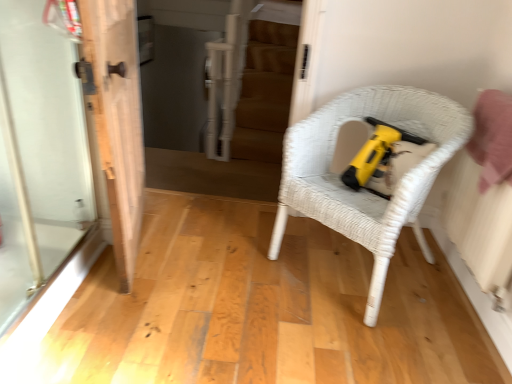
The height and width of the screenshot is (384, 512). I want to click on white wicker chair at center, so click(366, 191).

Describe the element at coordinates (366, 191) in the screenshot. I see `white wicker chair at center` at that location.

In order to click on white wood door at left in this screenshot , I will do `click(117, 119)`.

Considering the sizes of objects white wood door at left and white wicker chair at center in the image provided, who is thinner, white wood door at left or white wicker chair at center?

Thinner between the two is white wood door at left.

Can we say white wood door at left lies outside white wicker chair at center?

white wood door at left lies outside white wicker chair at center's area.

From a real-world perspective, is white wood door at left under white wicker chair at center?

No, from a real-world perspective, white wood door at left is not under white wicker chair at center.

From the image's perspective, which one is positioned higher, white wood door at left or white wicker chair at center?

From the image's view, white wood door at left is above.

Which is in front, transparent glass screen door at left or white wicker chair at center?

transparent glass screen door at left is closer to the camera.

Could you tell me if transparent glass screen door at left is turned towards white wicker chair at center?

Yes, transparent glass screen door at left is aimed at white wicker chair at center.

Who is bigger, transparent glass screen door at left or white wicker chair at center?

white wicker chair at center.

Is white wood door at left completely or partially inside white wicker chair at center?

No, white wood door at left is located outside of white wicker chair at center.

In the image, is white wicker chair at center on the left side or the right side of white wood door at left?

white wicker chair at center is to the right of white wood door at left.

Is white wicker chair at center aimed at white wood door at left?

No, white wicker chair at center is not facing towards white wood door at left.

Which is more to the left, white wood door at left or transparent glass screen door at left?

Positioned to the left is transparent glass screen door at left.

Does white wood door at left have a smaller size compared to transparent glass screen door at left?

Incorrect, white wood door at left is not smaller in size than transparent glass screen door at left.

Is white wood door at left facing towards transparent glass screen door at left?

No, white wood door at left is not aimed at transparent glass screen door at left.

Does point (111, 159) lie in front of point (80, 152)?

Yes, it is.

Based on the photo, is transparent glass screen door at left at the back of white wicker chair at center?

That's not correct — white wicker chair at center is not looking away from transparent glass screen door at left.

Measure the distance from white wicker chair at center to transparent glass screen door at left.

They are 1.07 meters apart.

From the picture: From a real-world perspective, does white wicker chair at center stand above transparent glass screen door at left?

Incorrect, from a real-world perspective, white wicker chair at center is lower than transparent glass screen door at left.

Considering the relative positions of transparent glass screen door at left and white wood door at left in the image provided, is transparent glass screen door at left to the left of white wood door at left from the viewer's perspective?

Correct, you'll find transparent glass screen door at left to the left of white wood door at left.

Does transparent glass screen door at left contain white wood door at left?

No, white wood door at left is not inside transparent glass screen door at left.

Is transparent glass screen door at left not near white wood door at left?

No, transparent glass screen door at left is in close proximity to white wood door at left.

From the image's perspective, relative to white wood door at left, is transparent glass screen door at left above or below?

Clearly, from the image's perspective, transparent glass screen door at left is below white wood door at left.

At what (x,y) coordinates should I click in order to perform the action: click on door positioned vertically above the white wicker chair at center (from a real-world perspective). Please return your answer as a coordinate pair (x, y). The height and width of the screenshot is (384, 512). Looking at the image, I should click on coord(117,119).

The width and height of the screenshot is (512, 384). In order to click on chair to the right of transparent glass screen door at left in this screenshot , I will do `click(366, 191)`.

Based on their spatial positions, is white wood door at left or transparent glass screen door at left further from white wicker chair at center?

transparent glass screen door at left is positioned further to the anchor white wicker chair at center.

When comparing their distances from white wood door at left, does white wicker chair at center or transparent glass screen door at left seem closer?

Among the two, transparent glass screen door at left is located nearer to white wood door at left.

Based on their spatial positions, is transparent glass screen door at left or white wicker chair at center further from white wood door at left?

white wicker chair at center is further to white wood door at left.

Estimate the real-world distances between objects in this image. Which object is further from white wicker chair at center, transparent glass screen door at left or white wood door at left?

transparent glass screen door at left lies further to white wicker chair at center than the other object.

Estimate the real-world distances between objects in this image. Which object is closer to transparent glass screen door at left, white wood door at left or white wicker chair at center?

white wood door at left.

Considering their positions, is white wicker chair at center positioned further to transparent glass screen door at left than white wood door at left?

white wicker chair at center is further to transparent glass screen door at left.

This screenshot has width=512, height=384. What are the coordinates of `door between transparent glass screen door at left and white wicker chair at center` in the screenshot? It's located at (117, 119).